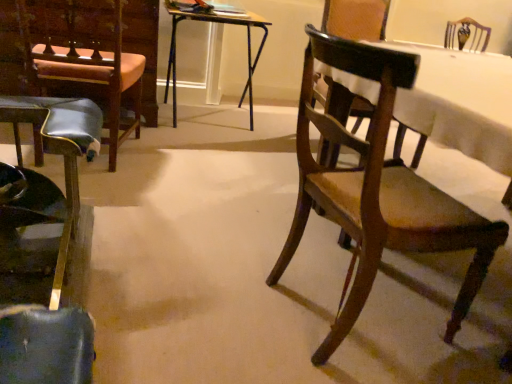
In order to face shiny black stool at left, placed as the 2th chair when sorted from right to left, should I rotate leftwards or rightwards?

A 29.212 degree turn to the left will do.

The image size is (512, 384). What are the coordinates of `wooden chair at right, the first chair positioned from the right` in the screenshot? It's located at (378, 191).

What do you see at coordinates (378, 191) in the screenshot? This screenshot has height=384, width=512. I see `wooden chair at right, the first chair positioned from the right` at bounding box center [378, 191].

What do you see at coordinates (83, 56) in the screenshot? I see `leather seat at left, the first armchair positioned from the left` at bounding box center [83, 56].

Where is `leather seat at left, the first armchair positioned from the left`? leather seat at left, the first armchair positioned from the left is located at coordinates (83, 56).

Describe the element at coordinates (213, 23) in the screenshot. I see `wooden folding table at center` at that location.

What is the approximate width of wooden chair at right, the second armchair viewed from the left?

21.75 inches.

Where is `shiny black stool at left, placed as the 2th chair when sorted from right to left`? The height and width of the screenshot is (384, 512). shiny black stool at left, placed as the 2th chair when sorted from right to left is located at coordinates (46, 249).

Is wooden folding table at center aimed at shiny black stool at left, the 1th chair when ordered from left to right?

Yes, wooden folding table at center is facing shiny black stool at left, the 1th chair when ordered from left to right.

How much distance is there between wooden folding table at center and shiny black stool at left, placed as the 2th chair when sorted from right to left?

A: 5.99 feet.

From a real-world perspective, is wooden folding table at center above or below shiny black stool at left, placed as the 2th chair when sorted from right to left?

Clearly, from a real-world perspective, wooden folding table at center is above shiny black stool at left, placed as the 2th chair when sorted from right to left.

Image resolution: width=512 pixels, height=384 pixels. I want to click on table on the right of shiny black stool at left, placed as the 2th chair when sorted from right to left, so click(213, 23).

Is wooden chair at right, the 1th armchair from the right, oriented towards wooden chair at right, positioned as the 2th chair in left-to-right order?

Yes, wooden chair at right, the 1th armchair from the right, is aimed at wooden chair at right, positioned as the 2th chair in left-to-right order.

The height and width of the screenshot is (384, 512). Find the location of `the 2nd armchair above when counting from the wooden chair at right, positioned as the 2th chair in left-to-right order (from the image's perspective)`. the 2nd armchair above when counting from the wooden chair at right, positioned as the 2th chair in left-to-right order (from the image's perspective) is located at coordinates (356, 19).

In terms of size, does wooden chair at right, the second armchair viewed from the left, appear bigger or smaller than wooden chair at right, the first chair positioned from the right?

Considering their sizes, wooden chair at right, the second armchair viewed from the left, takes up less space than wooden chair at right, the first chair positioned from the right.

Looking at this image, from a real-world perspective, who is located higher, wooden chair at right, the second armchair viewed from the left, or wooden chair at right, the first chair positioned from the right?

In real-world perspective, wooden chair at right, the second armchair viewed from the left, is above.

Is point (172, 62) closer or farther from the camera than point (340, 103)?

Point (172, 62).

From a real-world perspective, which object rests below the other?

wooden folding table at center, from a real-world perspective.

What's the angular difference between wooden folding table at center and wooden chair at right, the second armchair viewed from the left,'s facing directions?

4.01 degrees separate the facing orientations of wooden folding table at center and wooden chair at right, the second armchair viewed from the left.

Between wooden folding table at center and wooden chair at right, the 1th armchair from the right, which one has larger width?

wooden folding table at center is wider.

Between wooden chair at right, positioned as the 2th chair in left-to-right order, and wooden folding table at center, which one appears on the left side from the viewer's perspective?

From the viewer's perspective, wooden folding table at center appears more on the left side.

Does wooden chair at right, positioned as the 2th chair in left-to-right order, lie in front of wooden folding table at center?

Yes, it is in front of wooden folding table at center.

Image resolution: width=512 pixels, height=384 pixels. What are the coordinates of `chair that is on the right side of wooden folding table at center` in the screenshot? It's located at 378,191.

From their relative heights in the image, would you say wooden chair at right, the first chair positioned from the right, is taller or shorter than wooden folding table at center?

Clearly, wooden chair at right, the first chair positioned from the right, is taller compared to wooden folding table at center.

Considering the positions of objects wooden folding table at center and leather seat at left, the second armchair viewed from the right, in the image provided, who is in front, wooden folding table at center or leather seat at left, the second armchair viewed from the right,?

Positioned in front is leather seat at left, the second armchair viewed from the right.

Is leather seat at left, the first armchair positioned from the left, located within wooden folding table at center?

Definitely not — leather seat at left, the first armchair positioned from the left, is not inside wooden folding table at center.

From a real-world perspective, is wooden folding table at center physically located above or below leather seat at left, the second armchair viewed from the right?

wooden folding table at center is below leather seat at left, the second armchair viewed from the right.

This screenshot has width=512, height=384. Identify the location of table lying above the leather seat at left, the second armchair viewed from the right (from the image's perspective). (213, 23).

Which is in front, point (111, 136) or point (3, 255)?

The point (3, 255) is closer.

Can you confirm if leather seat at left, the second armchair viewed from the right, is taller than shiny black stool at left, the 1th chair when ordered from left to right?

Indeed, leather seat at left, the second armchair viewed from the right, has a greater height compared to shiny black stool at left, the 1th chair when ordered from left to right.

In the scene shown: Is leather seat at left, the second armchair viewed from the right, not near shiny black stool at left, the 1th chair when ordered from left to right?

No, there isn't a large distance between leather seat at left, the second armchair viewed from the right, and shiny black stool at left, the 1th chair when ordered from left to right.

Can you confirm if shiny black stool at left, placed as the 2th chair when sorted from right to left, is smaller than leather seat at left, the second armchair viewed from the right?

No.

Is shiny black stool at left, placed as the 2th chair when sorted from right to left, at the right side of leather seat at left, the second armchair viewed from the right?

Correct, you'll find shiny black stool at left, placed as the 2th chair when sorted from right to left, to the right of leather seat at left, the second armchair viewed from the right.

There is a shiny black stool at left, placed as the 2th chair when sorted from right to left. Where is `table above it (from a real-world perspective)`? table above it (from a real-world perspective) is located at coordinates (213, 23).

The image size is (512, 384). Find the location of `the 1st chair directly beneath the wooden chair at right, the second armchair viewed from the left (from a real-world perspective)`. the 1st chair directly beneath the wooden chair at right, the second armchair viewed from the left (from a real-world perspective) is located at coordinates pyautogui.click(x=378, y=191).

Which object lies further to the anchor point shiny black stool at left, the 1th chair when ordered from left to right, wooden chair at right, positioned as the 2th chair in left-to-right order, or wooden folding table at center?

Based on the image, wooden folding table at center appears to be further to shiny black stool at left, the 1th chair when ordered from left to right.

Based on their spatial positions, is wooden chair at right, the second armchair viewed from the left, or leather seat at left, the second armchair viewed from the right, further from wooden chair at right, the first chair positioned from the right?

wooden chair at right, the second armchair viewed from the left, lies further to wooden chair at right, the first chair positioned from the right, than the other object.

Which object lies further to the anchor point leather seat at left, the first armchair positioned from the left, shiny black stool at left, placed as the 2th chair when sorted from right to left, or wooden folding table at center?

wooden folding table at center.

Based on their spatial positions, is leather seat at left, the first armchair positioned from the left, or wooden chair at right, the second armchair viewed from the left, further from shiny black stool at left, the 1th chair when ordered from left to right?

wooden chair at right, the second armchair viewed from the left.

When comparing their distances from wooden chair at right, positioned as the 2th chair in left-to-right order, does wooden chair at right, the second armchair viewed from the left, or shiny black stool at left, the 1th chair when ordered from left to right, seem closer?

shiny black stool at left, the 1th chair when ordered from left to right.

When comparing their distances from wooden chair at right, the second armchair viewed from the left, does shiny black stool at left, the 1th chair when ordered from left to right, or wooden folding table at center seem further?

shiny black stool at left, the 1th chair when ordered from left to right, is further to wooden chair at right, the second armchair viewed from the left.

When comparing their distances from wooden folding table at center, does leather seat at left, the first armchair positioned from the left, or wooden chair at right, the second armchair viewed from the left, seem closer?

Based on the image, leather seat at left, the first armchair positioned from the left, appears to be nearer to wooden folding table at center.

Based on their spatial positions, is wooden folding table at center or wooden chair at right, the first chair positioned from the right, further from wooden chair at right, the 1th armchair from the right?

wooden chair at right, the first chair positioned from the right, is positioned further to the anchor wooden chair at right, the 1th armchair from the right.

The image size is (512, 384). I want to click on armchair between leather seat at left, the first armchair positioned from the left, and wooden chair at right, positioned as the 2th chair in left-to-right order, from left to right, so click(x=356, y=19).

What are the coordinates of `chair between shiny black stool at left, placed as the 2th chair when sorted from right to left, and wooden folding table at center from front to back` in the screenshot? It's located at (378, 191).

Image resolution: width=512 pixels, height=384 pixels. What are the coordinates of `table situated between leather seat at left, the second armchair viewed from the right, and wooden chair at right, the 1th armchair from the right, from left to right` in the screenshot? It's located at (213, 23).

Where is `chair between leather seat at left, the second armchair viewed from the right, and wooden chair at right, the first chair positioned from the right, in the horizontal direction`? The image size is (512, 384). chair between leather seat at left, the second armchair viewed from the right, and wooden chair at right, the first chair positioned from the right, in the horizontal direction is located at coordinates (46, 249).